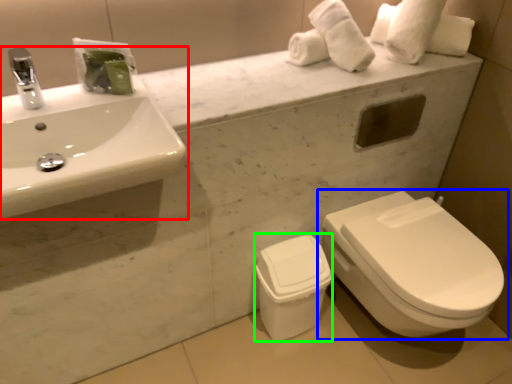
Question: Which object is positioned closest to sink (highlighted by a red box)? Select from toilet (highlighted by a blue box) and porcelain (highlighted by a green box).

Choices:
 (A) toilet
 (B) porcelain

Answer: (B)